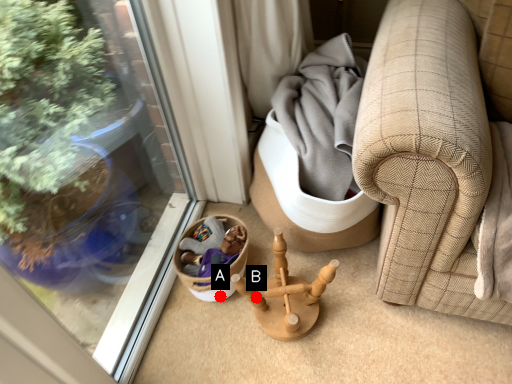
Question: Two points are circled on the image, labeled by A and B beside each circle. Among these points, which one is farthest from the camera?

Choices:
 (A) A is further
 (B) B is further

Answer: (B)